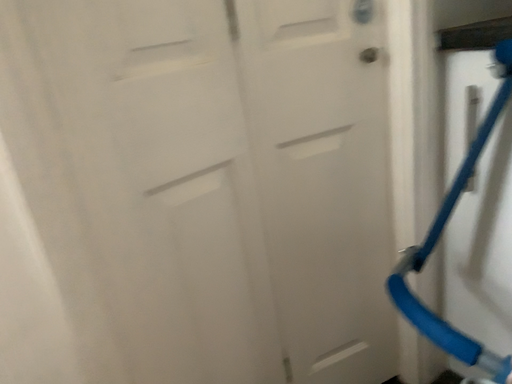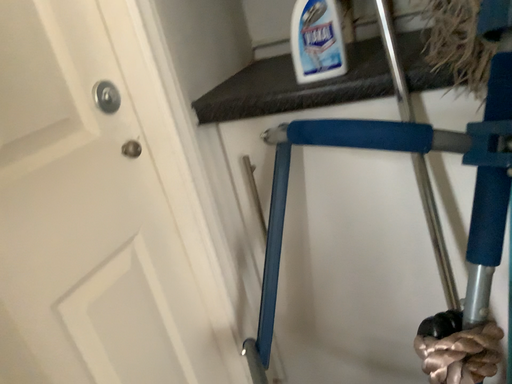
Question: Which way did the camera rotate in the video?

Choices:
 (A) rotated downward
 (B) rotated upward

Answer: (B)